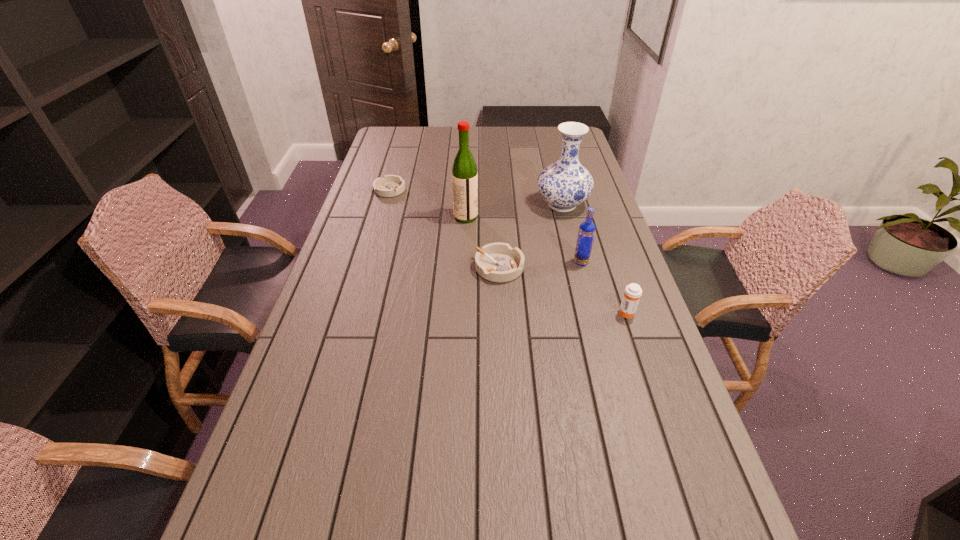
Please point a free position for a ashtray on the right. Please provide its 2D coordinates. Your answer should be formatted as a tuple, i.e. [(x, y)], where the tuple contains the x and y coordinates of a point satisfying the conditions above.

[(682, 396)]